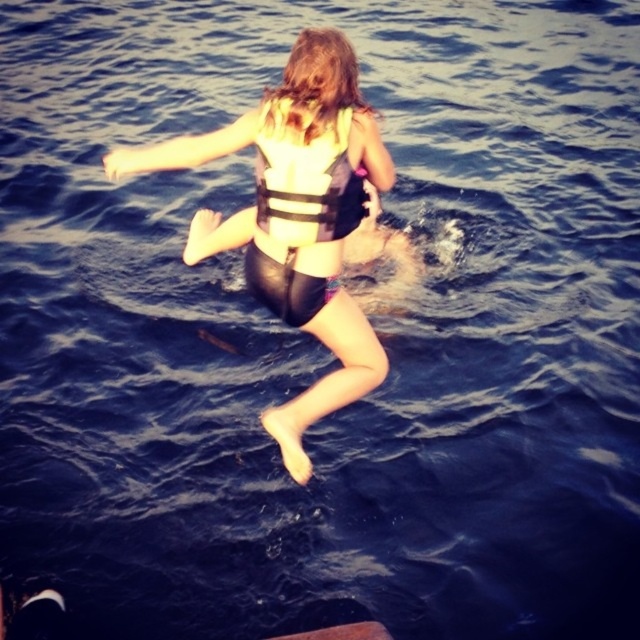
Question: Among these objects, which one is farthest from the camera?

Choices:
 (A) matte black swimsuit at center
 (B) yellow fabric life jacket at center

Answer: (B)

Question: Is the position of matte black swimsuit at center less distant than that of yellow fabric life jacket at center?

Choices:
 (A) no
 (B) yes

Answer: (B)

Question: Which object appears farthest from the camera in this image?

Choices:
 (A) yellow fabric life jacket at center
 (B) matte black swimsuit at center

Answer: (A)

Question: Does matte black swimsuit at center appear under yellow fabric life jacket at center?

Choices:
 (A) no
 (B) yes

Answer: (B)

Question: Is matte black swimsuit at center positioned before yellow fabric life jacket at center?

Choices:
 (A) no
 (B) yes

Answer: (B)